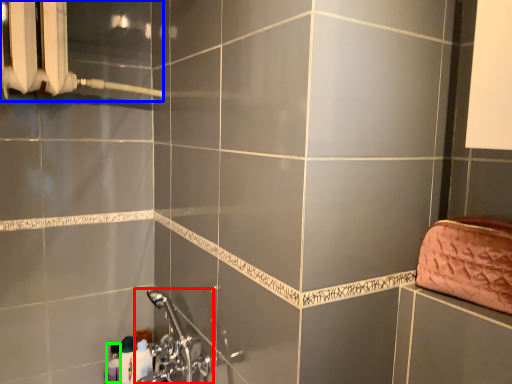
Question: Estimate the real-world distances between objects in this image. Which object is closer to plumbing fixture (highlighted by a red box), shower (highlighted by a blue box) or toiletry (highlighted by a green box)?

Choices:
 (A) shower
 (B) toiletry

Answer: (B)